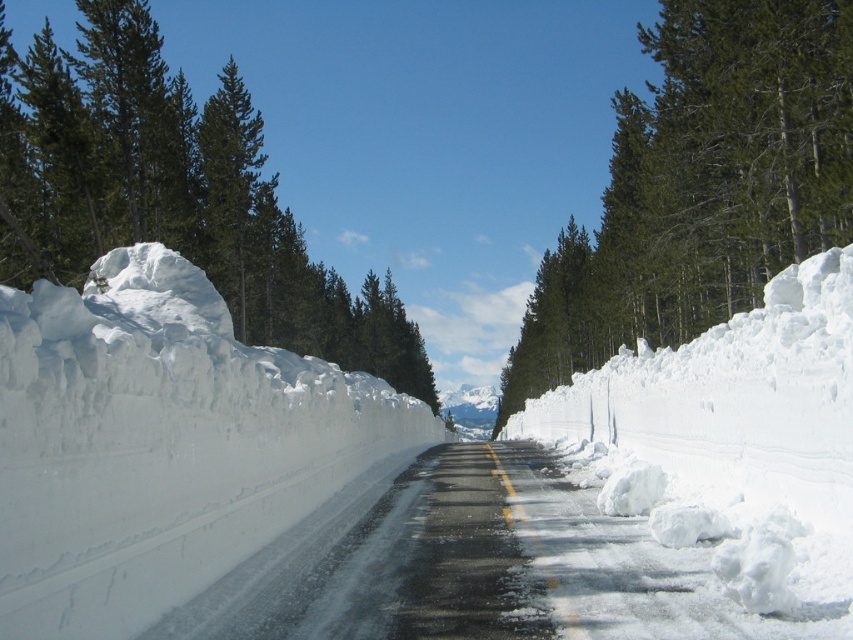
Question: Does white fluffy snow at left lie behind white fluffy snow at center?

Choices:
 (A) yes
 (B) no

Answer: (B)

Question: Which object appears farthest from the camera in this image?

Choices:
 (A) green coniferous tree at left
 (B) white fluffy snow at left

Answer: (A)

Question: Considering the relative positions of white fluffy snow at left and green coniferous tree at left in the image provided, where is white fluffy snow at left located with respect to green coniferous tree at left?

Choices:
 (A) above
 (B) below

Answer: (B)

Question: Is white fluffy snow at center closer to the viewer compared to green matte tree at upper center?

Choices:
 (A) no
 (B) yes

Answer: (B)

Question: Which object appears closest to the camera in this image?

Choices:
 (A) white fluffy snow at center
 (B) green matte tree at upper center

Answer: (A)

Question: Among these objects, which one is nearest to the camera?

Choices:
 (A) white fluffy snow at center
 (B) green coniferous tree at left
 (C) green matte tree at upper center

Answer: (A)